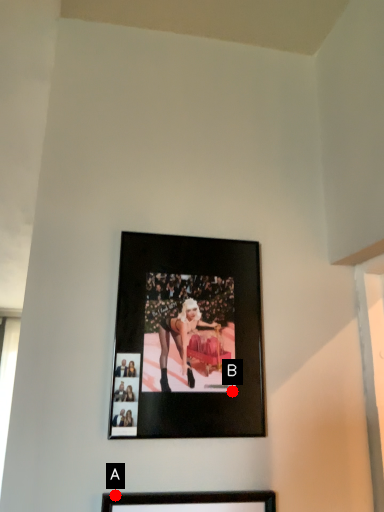
Question: Two points are circled on the image, labeled by A and B beside each circle. Which point appears farthest from the camera in this image?

Choices:
 (A) A is further
 (B) B is further

Answer: (B)